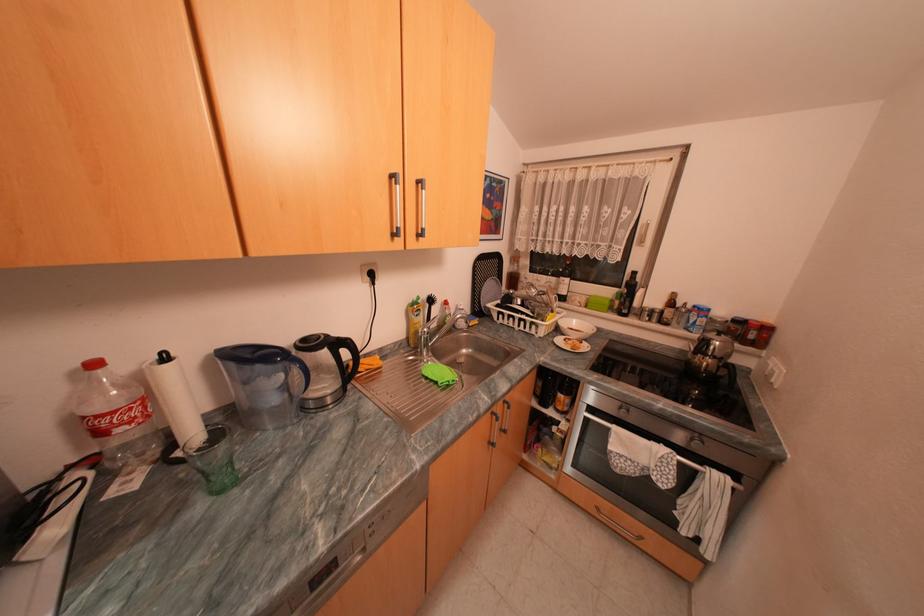
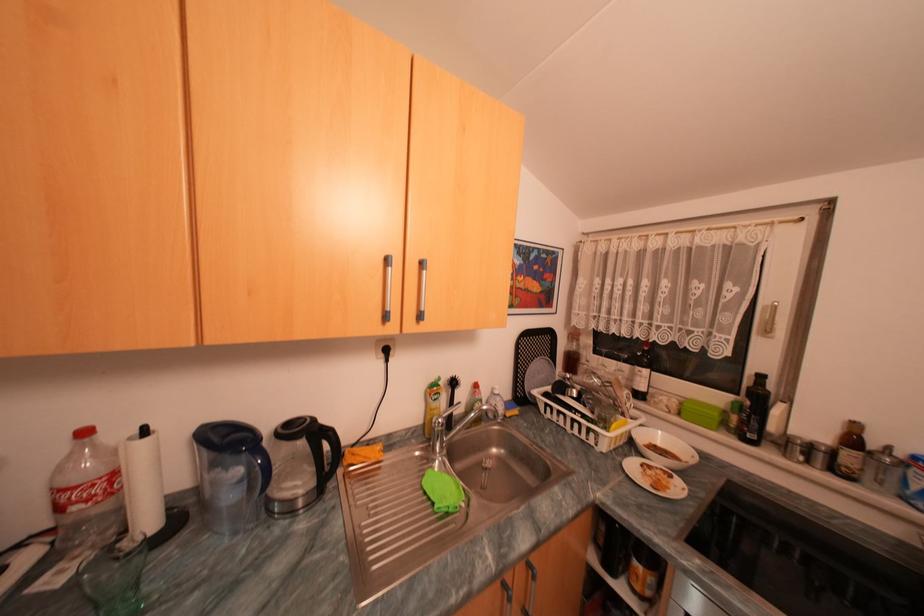
Find the pixel in the second image that matches pixel 355 352 in the first image.

(334, 445)